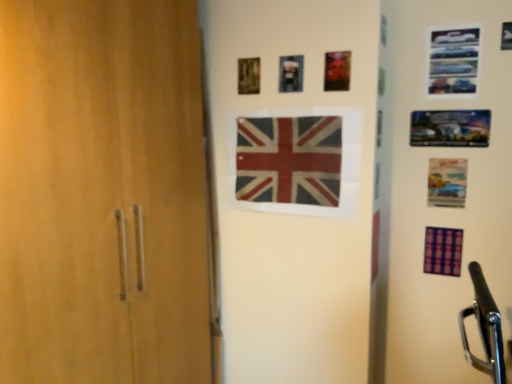
Question: From the image's perspective, is metallic blue picture frame at upper right, which appears as the fourth picture frame when viewed from the left, beneath purple fabric flag at lower right, which is counted as the 2th flag, starting from the left?

Choices:
 (A) no
 (B) yes

Answer: (A)

Question: Is metallic blue picture frame at upper right, which ranks as the 1th picture frame in right-to-left order, taller than purple fabric flag at lower right, marked as the 1th flag in a bottom-to-top arrangement?

Choices:
 (A) no
 (B) yes

Answer: (B)

Question: Can you confirm if metallic blue picture frame at upper right, which ranks as the 1th picture frame in right-to-left order, is shorter than purple fabric flag at lower right, marked as the 1th flag in a bottom-to-top arrangement?

Choices:
 (A) yes
 (B) no

Answer: (B)

Question: Can purple fabric flag at lower right, the 2th flag when ordered from top to bottom, be found inside metallic blue picture frame at upper right, which ranks as the 1th picture frame in right-to-left order?

Choices:
 (A) no
 (B) yes

Answer: (A)

Question: Can you confirm if metallic blue picture frame at upper right, which appears as the fourth picture frame when viewed from the left, is bigger than purple fabric flag at lower right, which is counted as the 2th flag, starting from the left?

Choices:
 (A) no
 (B) yes

Answer: (B)

Question: Is metallic blue picture frame at upper right, which appears as the fourth picture frame when viewed from the left, closer to camera compared to purple fabric flag at lower right, marked as the 1th flag in a bottom-to-top arrangement?

Choices:
 (A) yes
 (B) no

Answer: (A)

Question: From a real-world perspective, is metallic blue picture frame at upper right, which ranks as the 1th picture frame in right-to-left order, on top of metallic silver picture frame at upper center, placed as the 2th picture frame when sorted from left to right?

Choices:
 (A) yes
 (B) no

Answer: (A)

Question: From a real-world perspective, is metallic blue picture frame at upper right, which ranks as the 1th picture frame in right-to-left order, located beneath metallic silver picture frame at upper center, placed as the 2th picture frame when sorted from left to right?

Choices:
 (A) no
 (B) yes

Answer: (A)

Question: Can you see metallic blue picture frame at upper right, which ranks as the 1th picture frame in right-to-left order, touching metallic silver picture frame at upper center, acting as the 3th picture frame starting from the right?

Choices:
 (A) yes
 (B) no

Answer: (B)

Question: Considering the relative sizes of metallic blue picture frame at upper right, which ranks as the 1th picture frame in right-to-left order, and metallic silver picture frame at upper center, acting as the 3th picture frame starting from the right, in the image provided, is metallic blue picture frame at upper right, which ranks as the 1th picture frame in right-to-left order, thinner than metallic silver picture frame at upper center, acting as the 3th picture frame starting from the right,?

Choices:
 (A) no
 (B) yes

Answer: (B)

Question: Is the depth of metallic blue picture frame at upper right, which ranks as the 1th picture frame in right-to-left order, less than that of metallic silver picture frame at upper center, acting as the 3th picture frame starting from the right?

Choices:
 (A) yes
 (B) no

Answer: (A)

Question: Is metallic blue picture frame at upper right, which ranks as the 1th picture frame in right-to-left order, far from metallic silver picture frame at upper center, acting as the 3th picture frame starting from the right?

Choices:
 (A) yes
 (B) no

Answer: (B)

Question: From the image's perspective, is metallic blue picture frame at upper right, which appears as the fourth picture frame when viewed from the left, below metallic photo frame at upper right, which is the 3th picture frame in left-to-right order?

Choices:
 (A) no
 (B) yes

Answer: (A)